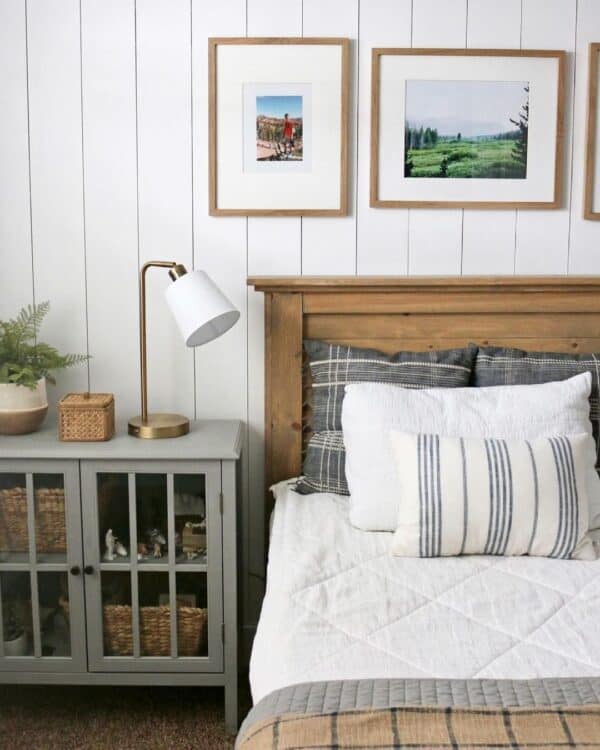
Find the location of a particular element. blanket is located at coordinates (409, 720), (400, 610), (410, 694).